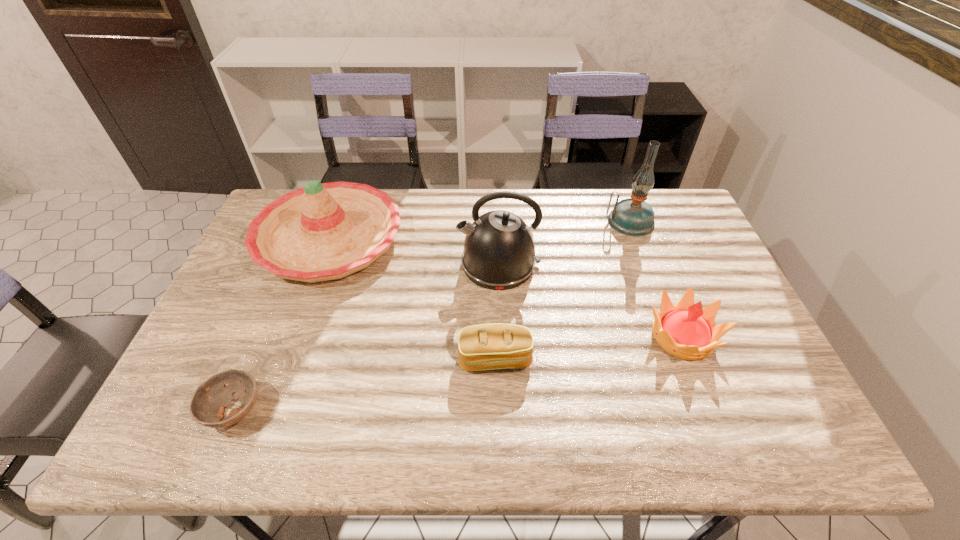
Locate an element on the screen. oil lamp that is positioned at the right edge is located at coordinates (634, 217).

Locate an element on the screen. crown at the right edge is located at coordinates (685, 330).

Find the location of `object that is at the far left corner`. object that is at the far left corner is located at coordinates (325, 231).

What are the coordinates of `object that is at the near left corner` in the screenshot? It's located at (207, 406).

The image size is (960, 540). I want to click on object located in the far right corner section of the desktop, so click(634, 217).

Locate an element on the screen. This screenshot has width=960, height=540. free space at the far edge of the desktop is located at coordinates (470, 204).

Where is `free space at the near edge of the desktop`? The height and width of the screenshot is (540, 960). free space at the near edge of the desktop is located at coordinates (446, 432).

Where is `vacant space at the left edge`? vacant space at the left edge is located at coordinates (261, 270).

Locate an element on the screen. This screenshot has width=960, height=540. vacant position at the right edge of the desktop is located at coordinates (687, 261).

You are a GUI agent. You are given a task and a screenshot of the screen. Output one action in this format:
    pyautogui.click(x=<x>, y=<y>)
    Task: Click on the vacant area at the far right corner
    
    Given the screenshot: What is the action you would take?
    pyautogui.click(x=671, y=219)